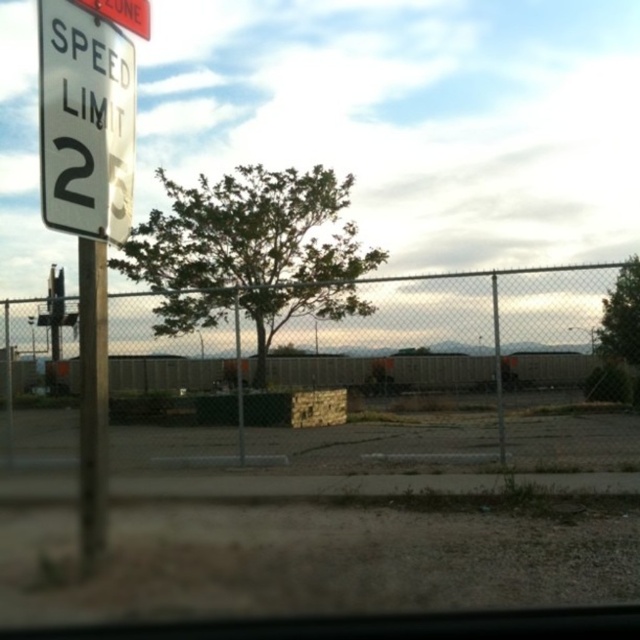
Where is `metal chain-link fence at center`? The image size is (640, 640). metal chain-link fence at center is located at coordinates (392, 378).

Does metal chain-link fence at center appear on the left side of metallic pole at left?

In fact, metal chain-link fence at center is to the right of metallic pole at left.

Does point (612, 372) lie behind point (92, 362)?

Yes, point (612, 372) is behind point (92, 362).

I want to click on metal chain-link fence at center, so click(392, 378).